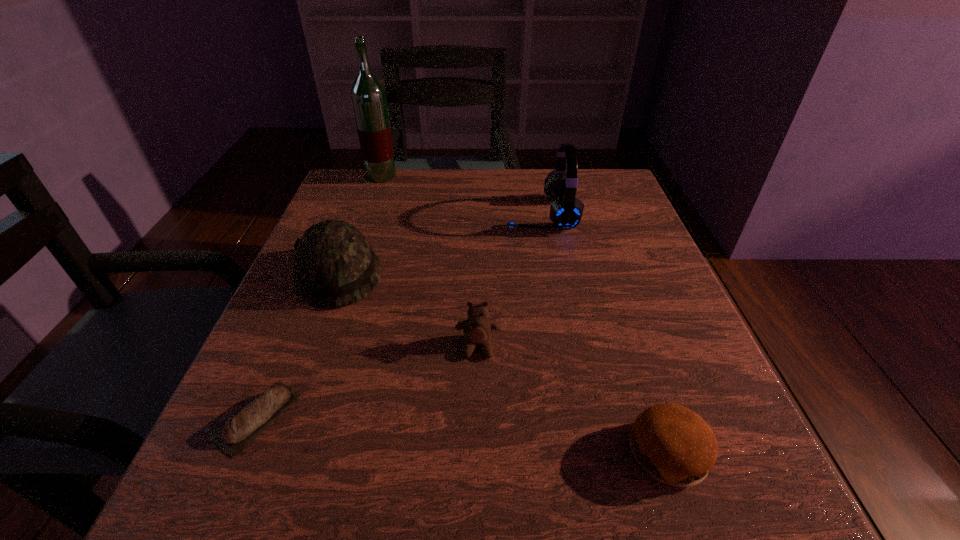
Find the location of a particular element. blank space located 0.280m on the ear cushions of the second farthest object is located at coordinates (385, 214).

Locate an element on the screen. free spot located 0.200m on the ear cushions of the second farthest object is located at coordinates (420, 214).

This screenshot has width=960, height=540. What are the coordinates of `vacant area located 0.300m on the ear cushions of the second farthest object` in the screenshot? It's located at (376, 214).

The width and height of the screenshot is (960, 540). In order to click on vacant area situated 0.320m on the right of the headwear in this screenshot , I will do `click(544, 274)`.

This screenshot has height=540, width=960. I want to click on vacant area situated 0.090m on the front-facing side of the fourth object from left to right, so click(x=477, y=410).

The width and height of the screenshot is (960, 540). In order to click on free space located 0.100m on the back of the hamburger in this screenshot , I will do `click(638, 362)`.

Where is `vacant space located on the back of the shortest object`? This screenshot has width=960, height=540. vacant space located on the back of the shortest object is located at coordinates (316, 282).

The image size is (960, 540). Identify the location of liquor located at the far edge. (368, 96).

Where is `headset at the far edge`? headset at the far edge is located at coordinates (566, 210).

Identify the location of object that is at the near edge. (672, 443).